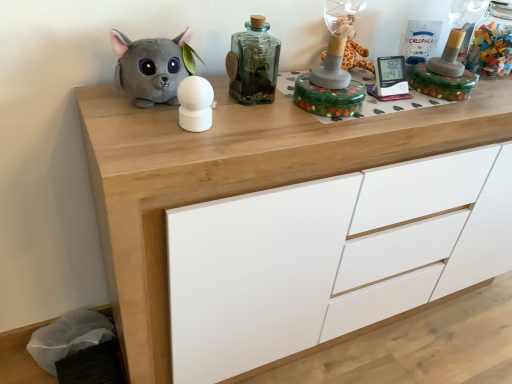
Find the location of `spots to the right of white matte sphere at center, the 2th toy from the left`. spots to the right of white matte sphere at center, the 2th toy from the left is located at coordinates 266,127.